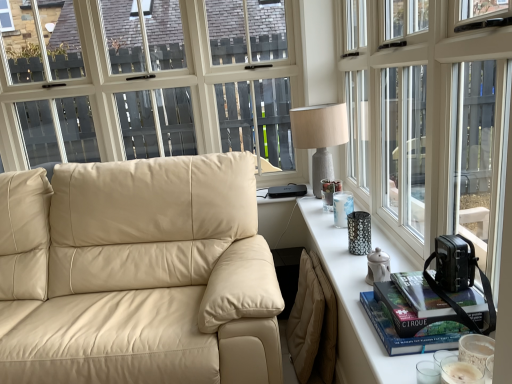
In order to face white glossy table at right, should I rotate leftwards or rightwards?

You should look right and rotate roughly 12.677 degrees.

Where is `transparent glass window at upper right`? transparent glass window at upper right is located at coordinates (430, 117).

Measure the distance between point (271, 350) and camera.

4.69 feet.

Find the location of a particular element. This screenshot has height=384, width=512. white glossy table at right is located at coordinates (353, 306).

Is white glossy table at right bigger or smaller than textured gray lamp at upper right?

Clearly, white glossy table at right is smaller in size than textured gray lamp at upper right.

From the picture: Is white glossy table at right wider than textured gray lamp at upper right?

Incorrect, the width of white glossy table at right does not surpass that of textured gray lamp at upper right.

How different are the orientations of white glossy table at right and textured gray lamp at upper right in degrees?

90.1 degrees separate the facing orientations of white glossy table at right and textured gray lamp at upper right.

From a real-world perspective, is white glossy table at right positioned above or below textured gray lamp at upper right?

Clearly, from a real-world perspective, white glossy table at right is below textured gray lamp at upper right.

Which point is more distant from viewer, (355, 381) or (430, 287)?

The point (355, 381) is farther from the camera.

Is white glossy table at right oriented towards hardcover book at right, arranged as the second book when ordered from the bottom?

No, white glossy table at right does not turn towards hardcover book at right, arranged as the second book when ordered from the bottom.

Locate an element on the screen. book that is the 1st object located behind the white glossy table at right is located at coordinates (421, 295).

Is transparent glass window at upper right with white glossy table at right?

There is a gap between transparent glass window at upper right and white glossy table at right.

From a real-world perspective, which is physically above, transparent glass window at upper right or white glossy table at right?

transparent glass window at upper right.

Considering the sizes of objects transparent glass window at upper right and white glossy table at right in the image provided, who is smaller, transparent glass window at upper right or white glossy table at right?

Smaller between the two is white glossy table at right.

Can you tell me how much transparent glass window at upper right and white glossy table at right differ in facing direction?

The angular difference between transparent glass window at upper right and white glossy table at right is 0.439 degrees.

Which is in front, hardcover book at right, marked as the first book in a bottom-to-top arrangement, or beige leather couch at left?

hardcover book at right, marked as the first book in a bottom-to-top arrangement, is closer to the camera.

Considering the sizes of objects hardcover book at right, the second book viewed from the top, and beige leather couch at left in the image provided, who is bigger, hardcover book at right, the second book viewed from the top, or beige leather couch at left?

beige leather couch at left.

What are the coordinates of `studio couch on the left of hardcover book at right, marked as the first book in a bottom-to-top arrangement` in the screenshot? It's located at (137, 274).

From a real-world perspective, is hardcover book at right, marked as the first book in a bottom-to-top arrangement, on top of beige leather couch at left?

Yes, from a real-world perspective, hardcover book at right, marked as the first book in a bottom-to-top arrangement, is above beige leather couch at left.

Is hardcover book at right, arranged as the second book when ordered from the bottom, looking in the opposite direction of textured gray lamp at upper right?

hardcover book at right, arranged as the second book when ordered from the bottom, does not have its back to textured gray lamp at upper right.

Which of these two, hardcover book at right, which appears as the first book when viewed from the top, or textured gray lamp at upper right, is smaller?

hardcover book at right, which appears as the first book when viewed from the top, is smaller.

Is hardcover book at right, which appears as the first book when viewed from the top, outside of textured gray lamp at upper right?

Yes.

Which is behind, point (231, 309) or point (471, 294)?

Point (231, 309)

The image size is (512, 384). There is a beige leather couch at left. In order to click on the 1st book above it (from a real-world perspective) in this screenshot , I will do `click(408, 323)`.

Is beige leather couch at left touching hardcover book at right, marked as the first book in a bottom-to-top arrangement?

No.

Which is in front, point (471, 309) or point (385, 251)?

Positioned in front is point (471, 309).

Based on the photo, who is shorter, hardcover book at right, arranged as the second book when ordered from the bottom, or white glossy table at right?

Standing shorter between the two is hardcover book at right, arranged as the second book when ordered from the bottom.

From a real-world perspective, is hardcover book at right, which appears as the first book when viewed from the top, positioned above or below white glossy table at right?

From a real-world perspective, hardcover book at right, which appears as the first book when viewed from the top, is physically above white glossy table at right.

Between hardcover book at right, arranged as the second book when ordered from the bottom, and white glossy table at right, which one has larger width?

With larger width is white glossy table at right.

You are a GUI agent. You are given a task and a screenshot of the screen. Output one action in this format:
    pyautogui.click(x=<x>, y=<y>)
    Task: Click on the table lamp located behind the white glossy table at right
    The image size is (512, 384).
    Given the screenshot: What is the action you would take?
    pyautogui.click(x=320, y=136)

From a real-world perspective, count 2nd books upward from the white glossy table at right and point to it. Please provide its 2D coordinates.

[(421, 295)]

From the image, which object appears to be farther from textured gray lamp at upper right, hardcover book at right, marked as the first book in a bottom-to-top arrangement, or transparent glass window at upper right?

hardcover book at right, marked as the first book in a bottom-to-top arrangement, is further to textured gray lamp at upper right.

From the image, which object appears to be nearer to white glossy table at right, transparent glass window at upper right or textured gray lamp at upper right?

Among the two, transparent glass window at upper right is located nearer to white glossy table at right.

From the image, which object appears to be farther from transparent glass window at upper right, beige leather couch at left or hardcover book at right, the second book viewed from the top?

beige leather couch at left is positioned further to the anchor transparent glass window at upper right.

Looking at this image, which object lies further to the anchor point hardcover book at right, which appears as the first book when viewed from the top, white glossy table at right or beige leather couch at left?

beige leather couch at left is positioned further to the anchor hardcover book at right, which appears as the first book when viewed from the top.

Based on their spatial positions, is beige leather couch at left or transparent glass window at upper right further from hardcover book at right, arranged as the second book when ordered from the bottom?

Based on the image, beige leather couch at left appears to be further to hardcover book at right, arranged as the second book when ordered from the bottom.

From the image, which object appears to be farther from transparent glass window at upper right, hardcover book at right, marked as the first book in a bottom-to-top arrangement, or beige leather couch at left?

The object further to transparent glass window at upper right is beige leather couch at left.

When comparing their distances from hardcover book at right, marked as the first book in a bottom-to-top arrangement, does beige leather couch at left or transparent glass window at upper right seem further?

beige leather couch at left is further to hardcover book at right, marked as the first book in a bottom-to-top arrangement.

When comparing their distances from transparent glass window at upper right, does hardcover book at right, marked as the first book in a bottom-to-top arrangement, or white glossy table at right seem further?

hardcover book at right, marked as the first book in a bottom-to-top arrangement.

Where is `table located between beige leather couch at left and hardcover book at right, which appears as the first book when viewed from the top, in the left-right direction`? The height and width of the screenshot is (384, 512). table located between beige leather couch at left and hardcover book at right, which appears as the first book when viewed from the top, in the left-right direction is located at coordinates (353, 306).

Find the location of a particular element. This screenshot has height=384, width=512. table between transparent glass window at upper right and textured gray lamp at upper right along the z-axis is located at coordinates (353, 306).

Identify the location of book between beige leather couch at left and hardcover book at right, arranged as the second book when ordered from the bottom. The height and width of the screenshot is (384, 512). (408, 323).

Locate an element on the screen. The height and width of the screenshot is (384, 512). book that lies between transparent glass window at upper right and hardcover book at right, marked as the first book in a bottom-to-top arrangement, from top to bottom is located at coordinates (421, 295).